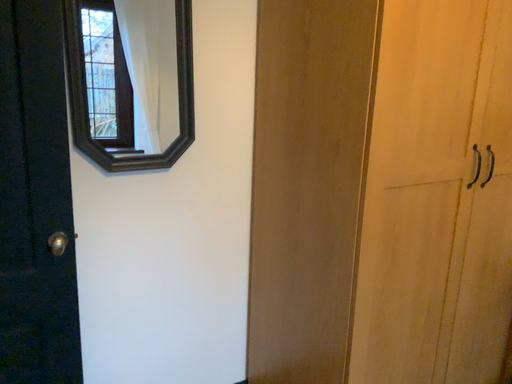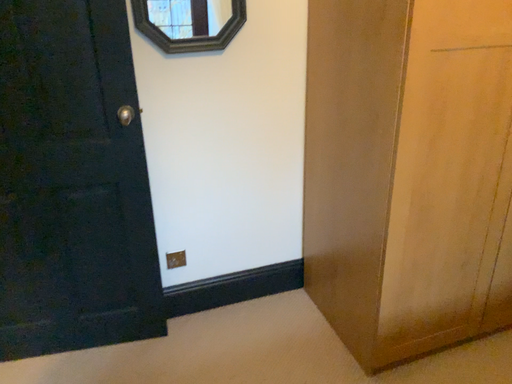
Question: Which way did the camera rotate in the video?

Choices:
 (A) rotated upward
 (B) rotated downward

Answer: (B)